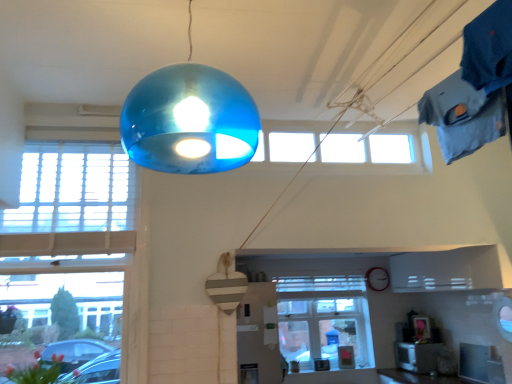
Question: From the image's perspective, is vivid pink petals at lower left located above white wooden window at left, which is the 1th window from left to right?

Choices:
 (A) no
 (B) yes

Answer: (A)

Question: Is vivid pink petals at lower left thinner than white wooden window at left, which is the 1th window in front-to-back order?

Choices:
 (A) yes
 (B) no

Answer: (B)

Question: Would you consider vivid pink petals at lower left to be distant from white wooden window at left, marked as the 3th window in a right-to-left arrangement?

Choices:
 (A) yes
 (B) no

Answer: (B)

Question: Is vivid pink petals at lower left behind white wooden window at left, which is the 1th window in front-to-back order?

Choices:
 (A) yes
 (B) no

Answer: (B)

Question: Does vivid pink petals at lower left lie in front of white wooden window at left, which is the 1th window in front-to-back order?

Choices:
 (A) yes
 (B) no

Answer: (A)

Question: Is vivid pink petals at lower left to the left or to the right of clear glass window at center, arranged as the 3th window when viewed from the front, in the image?

Choices:
 (A) right
 (B) left

Answer: (B)

Question: Is vivid pink petals at lower left inside the boundaries of clear glass window at center, the first window from the back, or outside?

Choices:
 (A) inside
 (B) outside

Answer: (B)

Question: From the image's perspective, relative to clear glass window at center, the first window from the back, is vivid pink petals at lower left above or below?

Choices:
 (A) below
 (B) above

Answer: (B)

Question: Does point (16, 367) appear closer or farther from the camera than point (336, 322)?

Choices:
 (A) closer
 (B) farther

Answer: (A)

Question: From a real-world perspective, relative to transparent glass window at upper center, placed as the 2th window when sorted from right to left, is clear glass window at center, the first window from the back, vertically above or below?

Choices:
 (A) above
 (B) below

Answer: (B)

Question: Is clear glass window at center, arranged as the 3th window when viewed from the front, situated inside transparent glass window at upper center, which ranks as the 2th window in back-to-front order, or outside?

Choices:
 (A) inside
 (B) outside

Answer: (B)

Question: Is clear glass window at center, which is the 3th window in left-to-right order, bigger or smaller than transparent glass window at upper center, which ranks as the 2th window in back-to-front order?

Choices:
 (A) small
 (B) big

Answer: (B)

Question: Considering the positions of point click(x=329, y=304) and point click(x=335, y=150), is point click(x=329, y=304) closer or farther from the camera than point click(x=335, y=150)?

Choices:
 (A) closer
 (B) farther

Answer: (B)

Question: From their relative heights in the image, would you say vivid pink petals at lower left is taller or shorter than transparent glass window at upper center, placed as the 2th window when sorted from right to left?

Choices:
 (A) tall
 (B) short

Answer: (B)

Question: Is point (54, 354) closer or farther from the camera than point (349, 140)?

Choices:
 (A) closer
 (B) farther

Answer: (A)